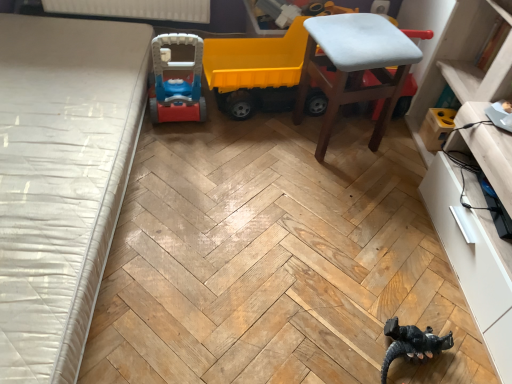
The image size is (512, 384). What are the coordinates of `vacant space in front of yellow plastic toy truck at center` in the screenshot? It's located at (259, 153).